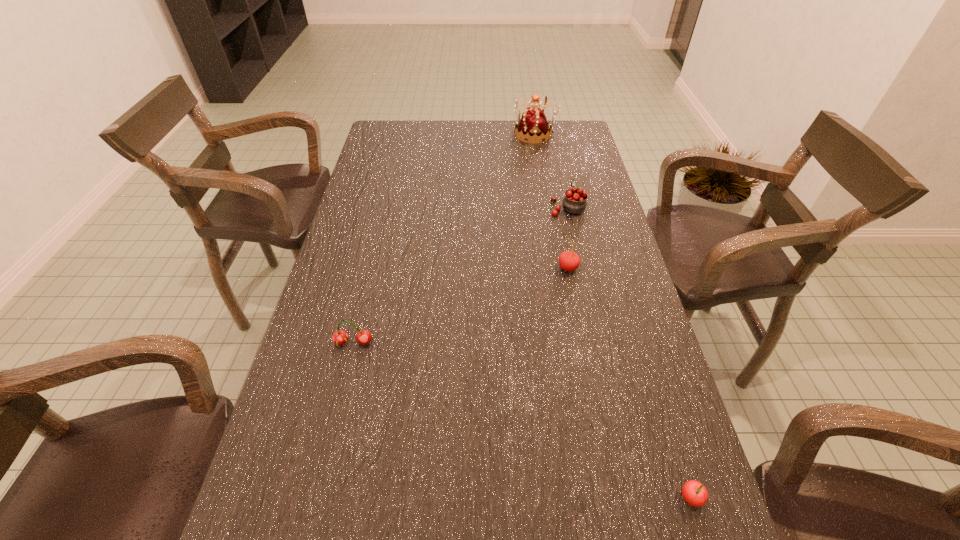
The image size is (960, 540). I want to click on free location located 0.090m on the front-facing side of the tallest object, so click(489, 134).

You are a GUI agent. You are given a task and a screenshot of the screen. Output one action in this format:
    pyautogui.click(x=<x>, y=<y>)
    Task: Click on the vacant area situated on the handle side of the farthest cherry
    
    Given the screenshot: What is the action you would take?
    pyautogui.click(x=551, y=137)

Identify the location of vacant point located on the handle side of the farthest cherry. (557, 163).

Find the location of a particular element. free spot located 0.350m on the handle side of the farthest cherry is located at coordinates (552, 141).

You are a GUI agent. You are given a task and a screenshot of the screen. Output one action in this format:
    pyautogui.click(x=<x>, y=<y>)
    Task: Click on the vacant space situated 0.070m on the back of the third nearest cherry
    The image size is (960, 540).
    Given the screenshot: What is the action you would take?
    click(564, 243)

I want to click on blank space located 0.180m on the left of the nearest object, so click(575, 498).

You are a GUI agent. You are given a task and a screenshot of the screen. Output one action in this format:
    pyautogui.click(x=<x>, y=<y>)
    Task: Click on the free location located 0.110m with stems pointing upwards on the leftmost object
    
    Given the screenshot: What is the action you would take?
    pyautogui.click(x=342, y=393)

You are a GUI agent. You are given a task and a screenshot of the screen. Output one action in this format:
    pyautogui.click(x=<x>, y=<y>)
    Task: Click on the object situated at the far edge
    The image size is (960, 540).
    Given the screenshot: What is the action you would take?
    pyautogui.click(x=533, y=124)

Identify the location of object at the left edge. (340, 337).

This screenshot has width=960, height=540. I want to click on tiara that is at the right edge, so click(x=533, y=124).